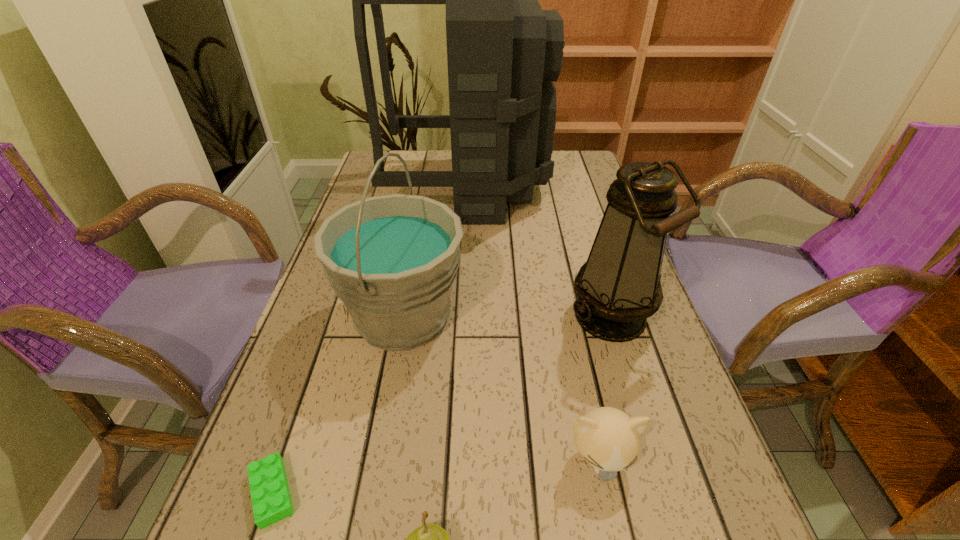
Locate an element on the screen. The width and height of the screenshot is (960, 540). free space at the far right corner of the desktop is located at coordinates (567, 164).

The height and width of the screenshot is (540, 960). Find the location of `free space between the shortest object and the kitten`. free space between the shortest object and the kitten is located at coordinates (436, 476).

Identify the location of free space between the bucket and the shortest object. (338, 404).

I want to click on free spot between the Lego and the kitten, so click(x=436, y=476).

Find the location of a particular element. The image size is (960, 540). vacant region between the oil lamp and the kitten is located at coordinates (606, 388).

Select which object is the fourth closest to the bucket. Please provide its 2D coordinates. Your answer should be formatted as a tuple, i.e. [(x, y)], where the tuple contains the x and y coordinates of a point satisfying the conditions above.

[(618, 288)]

Where is `object that is the fourth nearest to the pear`? Image resolution: width=960 pixels, height=540 pixels. object that is the fourth nearest to the pear is located at coordinates (618, 288).

What are the coordinates of `vacant point that satisfies the following two spatial constraints: 1. on the front compartment of the tallest object; 2. on the left side of the oil lamp` in the screenshot? It's located at (463, 317).